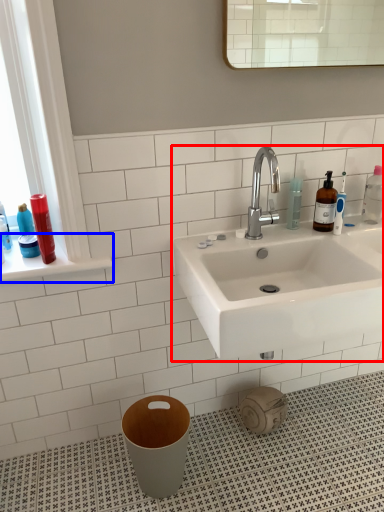
Question: Which object appears farthest to the camera in this image, sink (highlighted by a red box) or window sill (highlighted by a blue box)?

Choices:
 (A) sink
 (B) window sill

Answer: (B)